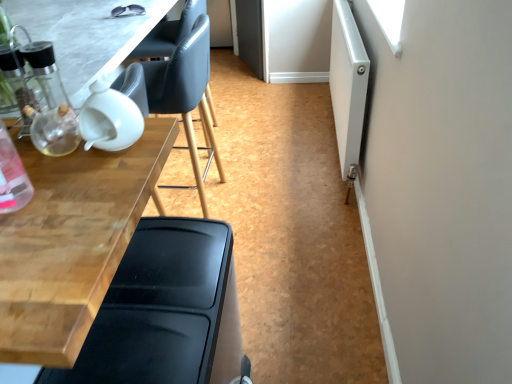
Where is `transparent glass table at upper left, placed as the first table when sorted from top to bottom`? The height and width of the screenshot is (384, 512). transparent glass table at upper left, placed as the first table when sorted from top to bottom is located at coordinates (86, 35).

Find the location of `black plastic chair at lower left, which is the 1th chair from bottom to top`. black plastic chair at lower left, which is the 1th chair from bottom to top is located at coordinates (165, 311).

What is the approximate width of wooden table at left, the 1th table in the bottom-to-top sequence?

It is 25.58 inches.

Where is `white matte screen door at right`? The width and height of the screenshot is (512, 384). white matte screen door at right is located at coordinates (347, 84).

At what (x,y) coordinates should I click in order to perform the action: click on transparent glass table at upper left, the second table positioned from the bottom. Please return your answer as a coordinate pair (x, y). Looking at the image, I should click on (86, 35).

Is wooden table at left, the 1th table in the bottom-to-top sequence, far from transparent glass table at upper left, placed as the first table when sorted from top to bottom?

They are positioned close to each other.

Where is `table located underneath the transparent glass table at upper left, the second table positioned from the bottom (from a real-world perspective)`? The width and height of the screenshot is (512, 384). table located underneath the transparent glass table at upper left, the second table positioned from the bottom (from a real-world perspective) is located at coordinates (70, 243).

Does point (9, 333) come behind point (104, 31)?

No, it is not.

Between wooden table at left, which is the 2th table from top to bottom, and transparent glass table at upper left, placed as the first table when sorted from top to bottom, which one is positioned in front?

wooden table at left, which is the 2th table from top to bottom, is in front.

Is matte black chair at upper left, the first chair when ordered from top to bottom, taller than wooden table at left, which is the 2th table from top to bottom?

Yes, matte black chair at upper left, the first chair when ordered from top to bottom, is taller than wooden table at left, which is the 2th table from top to bottom.

Consider the image. Considering the relative positions of matte black chair at upper left, which is the 2th chair from bottom to top, and wooden table at left, the 1th table in the bottom-to-top sequence, in the image provided, is matte black chair at upper left, which is the 2th chair from bottom to top, behind wooden table at left, the 1th table in the bottom-to-top sequence,?

Yes, matte black chair at upper left, which is the 2th chair from bottom to top, is further from the viewer.

Based on their sizes in the image, would you say matte black chair at upper left, the first chair when ordered from top to bottom, is bigger or smaller than wooden table at left, the 1th table in the bottom-to-top sequence?

Clearly, matte black chair at upper left, the first chair when ordered from top to bottom, is smaller in size than wooden table at left, the 1th table in the bottom-to-top sequence.

At what (x,y) coordinates should I click in order to perform the action: click on chair that is the 2nd one when counting rightward from the transparent glass table at upper left, placed as the first table when sorted from top to bottom. Please return your answer as a coordinate pair (x, y). This screenshot has width=512, height=384. Looking at the image, I should click on point(165,311).

Is transparent glass table at upper left, placed as the first table when sorted from top to bottom, shorter than black plastic chair at lower left, marked as the 2th chair in a top-to-bottom arrangement?

Correct, transparent glass table at upper left, placed as the first table when sorted from top to bottom, is not as tall as black plastic chair at lower left, marked as the 2th chair in a top-to-bottom arrangement.

Relative to black plastic chair at lower left, marked as the first chair in a front-to-back arrangement, is transparent glass table at upper left, placed as the first table when sorted from top to bottom, in front or behind?

transparent glass table at upper left, placed as the first table when sorted from top to bottom, is positioned farther from the viewer than black plastic chair at lower left, marked as the first chair in a front-to-back arrangement.

Who is smaller, transparent glass table at upper left, the second table positioned from the bottom, or black plastic chair at lower left, which is the 1th chair from bottom to top?

Smaller between the two is transparent glass table at upper left, the second table positioned from the bottom.

Is white matte screen door at right looking in the opposite direction of wooden table at left, which is the 2th table from top to bottom?

white matte screen door at right does not have its back to wooden table at left, which is the 2th table from top to bottom.

From a real-world perspective, is white matte screen door at right physically above wooden table at left, the 1th table in the bottom-to-top sequence?

Actually, white matte screen door at right is physically below wooden table at left, the 1th table in the bottom-to-top sequence, in the real world.

Does point (341, 163) come closer to viewer compared to point (22, 349)?

That is False.

Considering the sizes of white matte screen door at right and wooden table at left, which is the 2th table from top to bottom, in the image, is white matte screen door at right wider or thinner than wooden table at left, which is the 2th table from top to bottom,?

In the image, white matte screen door at right appears to be more narrow than wooden table at left, which is the 2th table from top to bottom.

From the image's perspective, would you say transparent glass table at upper left, placed as the first table when sorted from top to bottom, is shown under white matte screen door at right?

Yes, from the image's perspective, transparent glass table at upper left, placed as the first table when sorted from top to bottom, is below white matte screen door at right.

Considering the sizes of objects transparent glass table at upper left, the second table positioned from the bottom, and white matte screen door at right in the image provided, who is taller, transparent glass table at upper left, the second table positioned from the bottom, or white matte screen door at right?

white matte screen door at right.

Is white matte screen door at right completely or partially inside transparent glass table at upper left, the second table positioned from the bottom?

No, white matte screen door at right is not a part of transparent glass table at upper left, the second table positioned from the bottom.

Measure the distance between transparent glass table at upper left, placed as the first table when sorted from top to bottom, and white matte screen door at right.

transparent glass table at upper left, placed as the first table when sorted from top to bottom, and white matte screen door at right are 3.49 feet apart from each other.

Is matte black chair at upper left, which ranks as the first chair in back-to-front order, facing towards black plastic chair at lower left, marked as the first chair in a front-to-back arrangement?

No, matte black chair at upper left, which ranks as the first chair in back-to-front order, is not facing towards black plastic chair at lower left, marked as the first chair in a front-to-back arrangement.

Looking at their sizes, would you say matte black chair at upper left, which is the 2th chair from bottom to top, is wider or thinner than black plastic chair at lower left, marked as the first chair in a front-to-back arrangement?

In the image, matte black chair at upper left, which is the 2th chair from bottom to top, appears to be wider than black plastic chair at lower left, marked as the first chair in a front-to-back arrangement.

Can you tell me how much matte black chair at upper left, which is the 2th chair from bottom to top, and black plastic chair at lower left, marked as the first chair in a front-to-back arrangement, differ in facing direction?

There is a 177-degree angle between the facing directions of matte black chair at upper left, which is the 2th chair from bottom to top, and black plastic chair at lower left, marked as the first chair in a front-to-back arrangement.

From the white matte screen door at right, count 1st chairs forward and point to it. Please provide its 2D coordinates.

[(186, 96)]

Can you confirm if white matte screen door at right is taller than matte black chair at upper left, which ranks as the first chair in back-to-front order?

Incorrect, the height of white matte screen door at right is not larger of that of matte black chair at upper left, which ranks as the first chair in back-to-front order.

Is white matte screen door at right far away from matte black chair at upper left, which ranks as the first chair in back-to-front order?

They are positioned close to each other.

From the picture: From the image's perspective, does white matte screen door at right appear lower than matte black chair at upper left, which ranks as the first chair in back-to-front order?

Incorrect, from the image's perspective, white matte screen door at right is higher than matte black chair at upper left, which ranks as the first chair in back-to-front order.

The image size is (512, 384). I want to click on table that is on the left side of wooden table at left, the 1th table in the bottom-to-top sequence, so click(86, 35).

Locate an element on the screen. This screenshot has height=384, width=512. the 2nd table in front of the matte black chair at upper left, which ranks as the first chair in back-to-front order, counting from the anchor's position is located at coordinates (70, 243).

Looking at the image, which one is located further to black plastic chair at lower left, marked as the 2th chair in a top-to-bottom arrangement, wooden table at left, the 1th table in the bottom-to-top sequence, or transparent glass table at upper left, the second table positioned from the bottom?

Based on the image, transparent glass table at upper left, the second table positioned from the bottom, appears to be further to black plastic chair at lower left, marked as the 2th chair in a top-to-bottom arrangement.

When comparing their distances from white matte screen door at right, does black plastic chair at lower left, marked as the first chair in a front-to-back arrangement, or transparent glass table at upper left, placed as the first table when sorted from top to bottom, seem closer?

transparent glass table at upper left, placed as the first table when sorted from top to bottom, is closer to white matte screen door at right.

When comparing their distances from transparent glass table at upper left, placed as the first table when sorted from top to bottom, does wooden table at left, the 1th table in the bottom-to-top sequence, or matte black chair at upper left, the first chair when ordered from top to bottom, seem further?

The object further to transparent glass table at upper left, placed as the first table when sorted from top to bottom, is matte black chair at upper left, the first chair when ordered from top to bottom.

Considering their positions, is wooden table at left, which is the 2th table from top to bottom, positioned further to matte black chair at upper left, the first chair when ordered from top to bottom, than transparent glass table at upper left, the second table positioned from the bottom?

wooden table at left, which is the 2th table from top to bottom, is further to matte black chair at upper left, the first chair when ordered from top to bottom.

Looking at the image, which one is located closer to wooden table at left, which is the 2th table from top to bottom, matte black chair at upper left, which appears as the 2th chair when viewed from the front, or black plastic chair at lower left, marked as the 2th chair in a top-to-bottom arrangement?

black plastic chair at lower left, marked as the 2th chair in a top-to-bottom arrangement, is closer to wooden table at left, which is the 2th table from top to bottom.

Looking at the image, which one is located further to white matte screen door at right, matte black chair at upper left, which appears as the 2th chair when viewed from the front, or wooden table at left, the 1th table in the bottom-to-top sequence?

wooden table at left, the 1th table in the bottom-to-top sequence, is further to white matte screen door at right.

Based on their spatial positions, is wooden table at left, which is the 2th table from top to bottom, or black plastic chair at lower left, which is the 1th chair from bottom to top, further from matte black chair at upper left, the first chair when ordered from top to bottom?

Among the two, black plastic chair at lower left, which is the 1th chair from bottom to top, is located further to matte black chair at upper left, the first chair when ordered from top to bottom.

Estimate the real-world distances between objects in this image. Which object is closer to transparent glass table at upper left, placed as the first table when sorted from top to bottom, white matte screen door at right or matte black chair at upper left, which appears as the 2th chair when viewed from the front?

Among the two, matte black chair at upper left, which appears as the 2th chair when viewed from the front, is located nearer to transparent glass table at upper left, placed as the first table when sorted from top to bottom.

Find the location of `chair that lies between white matte screen door at right and black plastic chair at lower left, the second chair viewed from the back, from top to bottom`. chair that lies between white matte screen door at right and black plastic chair at lower left, the second chair viewed from the back, from top to bottom is located at coordinates (186, 96).

The image size is (512, 384). Identify the location of table between transparent glass table at upper left, placed as the first table when sorted from top to bottom, and black plastic chair at lower left, marked as the 2th chair in a top-to-bottom arrangement, in the up-down direction. (70, 243).

Locate an element on the screen. The width and height of the screenshot is (512, 384). table between wooden table at left, the 1th table in the bottom-to-top sequence, and matte black chair at upper left, which is the 2th chair from bottom to top, from front to back is located at coordinates (86, 35).

What are the coordinates of `table between transparent glass table at upper left, the second table positioned from the bottom, and white matte screen door at right, in the horizontal direction` in the screenshot? It's located at (70, 243).